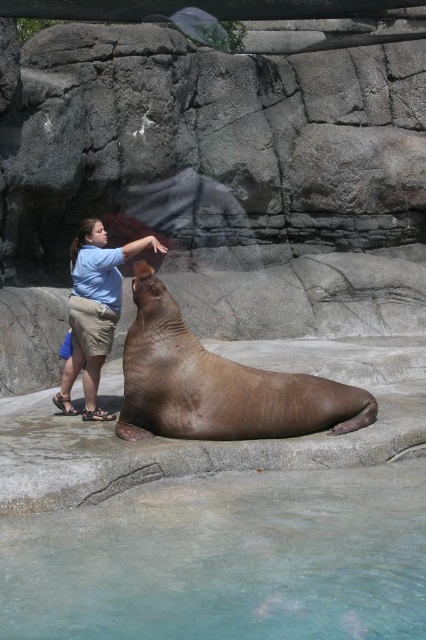
You are a visitor at the zoo and want to take a photo of the light blue shirt at center and the clear glass water at lower center. Which object will appear larger in your photo?

The clear glass water at lower center will appear larger in the photo because it is closer to the viewer than the light blue shirt at center.

You are a zookeeper trying to determine if a new feeding platform can accommodate both the brown smooth seal at center and the light blue shirt at center simultaneously. The platform is only wide enough for objects that are narrower than 1.2 meters. Can both fit on the platform?

The brown smooth seal at center might be wider than light blue shirt at center. Since the platform requires both to be narrower than 1.2 meters, but the seal might exceed this width, it is uncertain if both can fit. Further measurement is needed.

You are standing at the zoo and want to take a photo of the seal. There are two points marked in the scene. Point A is at coordinates point (25, 618) and Point B is at coordinates point (359, 422). Which point is closer to you so you can focus your camera lens properly?

Point A at coordinates point (25, 618) is closer to the viewer than point B at coordinates point (359, 422). Therefore, you should focus your camera lens on Point A for better clarity.